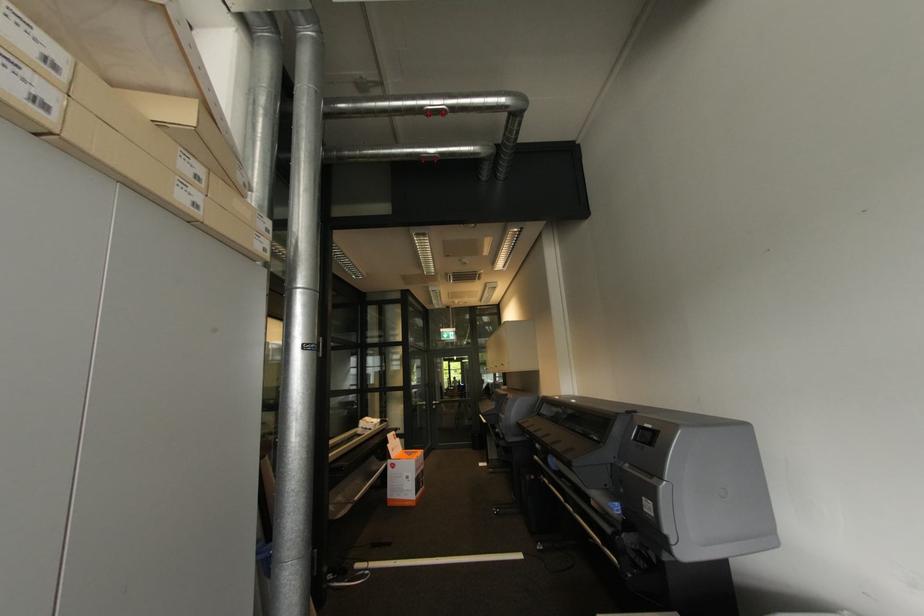
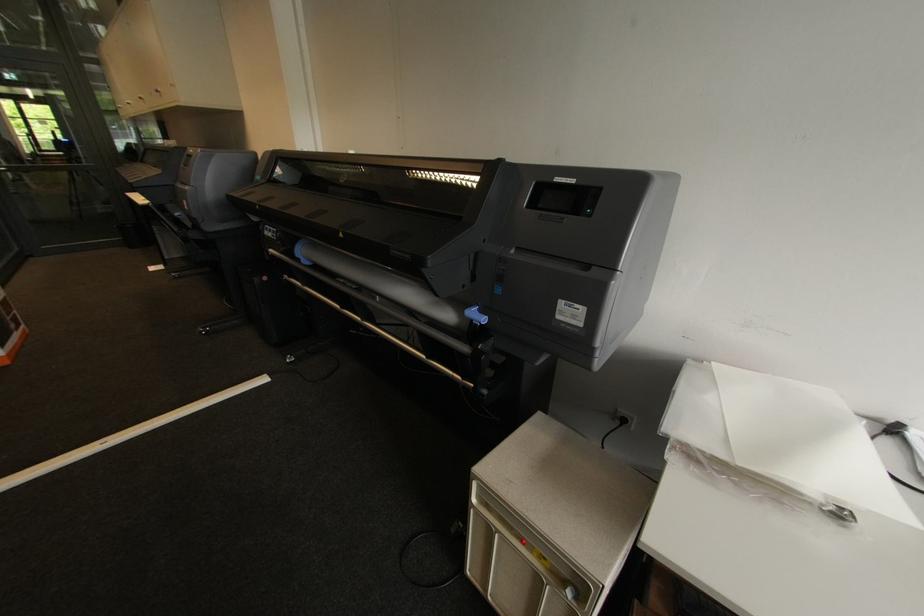
In the second image, find the point that corresponds to (621,505) in the first image.

(479, 310)